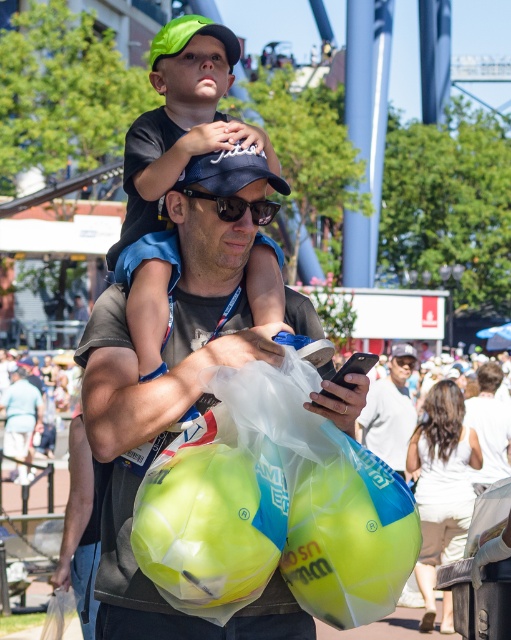
In the theme park scene, there is a man with a green matte cap at center and a neon yellow plastic beach ball at lower center. Which object is positioned to the left?

The green matte cap at center is positioned to the left of the neon yellow plastic beach ball at lower center.

You are trying to decide which object to place on a narrow shelf that can only hold one item. Which item should you choose between the green matte cap at center and the neon yellow plastic beach ball at lower center?

The green matte cap at center might be wider than the neon yellow plastic beach ball at lower center, so the neon yellow plastic beach ball at lower center is more likely to fit on the narrow shelf.